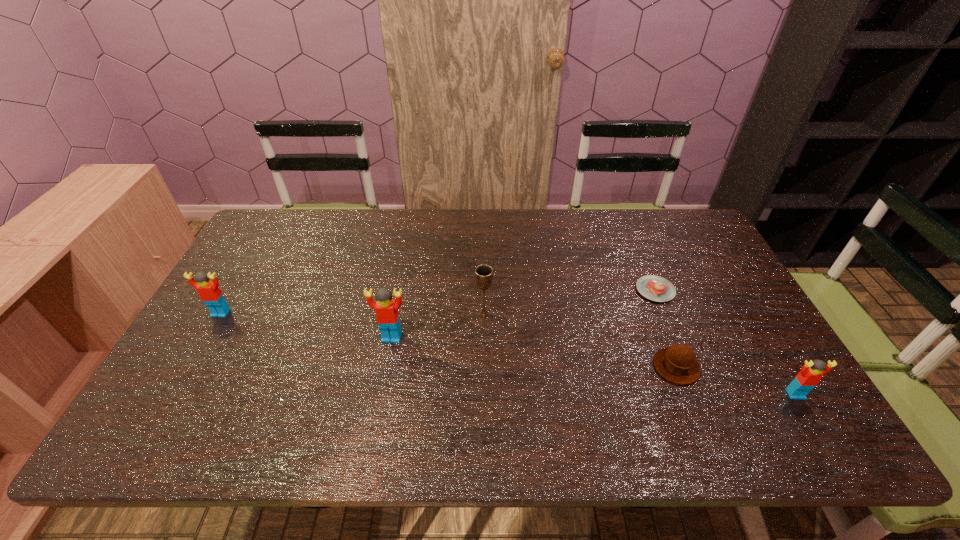
This screenshot has width=960, height=540. Identify the location of free spot that satisfies the following two spatial constraints: 1. on the face of the second shortest object; 2. on the left side of the second Lego from left to right. (386, 367).